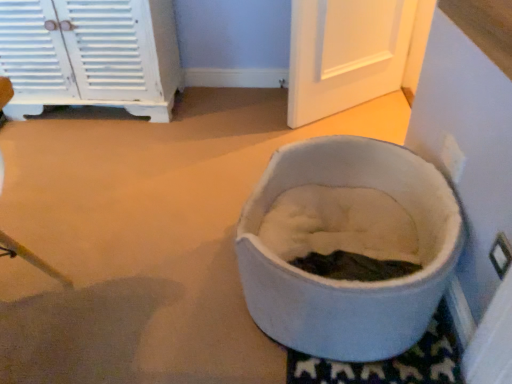
Question: From the image's perspective, is white painted wood cabinet at upper left under white soft pet bed at center?

Choices:
 (A) no
 (B) yes

Answer: (A)

Question: Can you confirm if white painted wood cabinet at upper left is shorter than white soft pet bed at center?

Choices:
 (A) yes
 (B) no

Answer: (B)

Question: Is white painted wood cabinet at upper left to the left of white soft pet bed at center from the viewer's perspective?

Choices:
 (A) yes
 (B) no

Answer: (A)

Question: Does white painted wood cabinet at upper left contain white soft pet bed at center?

Choices:
 (A) yes
 (B) no

Answer: (B)

Question: Considering the relative sizes of white painted wood cabinet at upper left and white soft pet bed at center in the image provided, is white painted wood cabinet at upper left thinner than white soft pet bed at center?

Choices:
 (A) no
 (B) yes

Answer: (B)

Question: Could you tell me if white painted wood cabinet at upper left is turned towards white soft pet bed at center?

Choices:
 (A) yes
 (B) no

Answer: (B)

Question: Could white painted wood cabinet at upper left be considered to be inside white soft pet bed at center?

Choices:
 (A) no
 (B) yes

Answer: (A)

Question: Considering the relative sizes of white soft pet bed at center and white painted wood cabinet at upper left in the image provided, is white soft pet bed at center wider than white painted wood cabinet at upper left?

Choices:
 (A) yes
 (B) no

Answer: (A)

Question: Does white soft pet bed at center appear on the left side of white painted wood cabinet at upper left?

Choices:
 (A) no
 (B) yes

Answer: (A)

Question: Considering the relative sizes of white soft pet bed at center and white painted wood cabinet at upper left in the image provided, is white soft pet bed at center taller than white painted wood cabinet at upper left?

Choices:
 (A) no
 (B) yes

Answer: (A)

Question: Are white soft pet bed at center and white painted wood cabinet at upper left located far from each other?

Choices:
 (A) yes
 (B) no

Answer: (A)

Question: Is white soft pet bed at center bigger than white painted wood cabinet at upper left?

Choices:
 (A) no
 (B) yes

Answer: (A)

Question: Choose the correct answer: Is white painted wood cabinet at upper left inside white soft pet bed at center or outside it?

Choices:
 (A) outside
 (B) inside

Answer: (A)